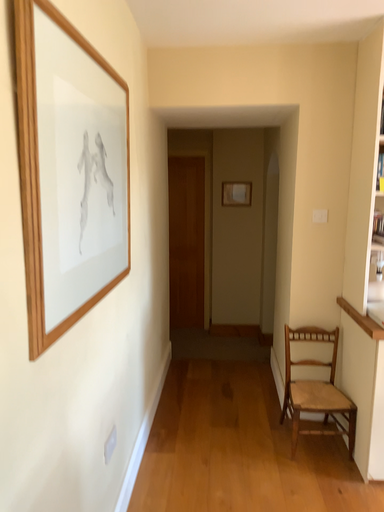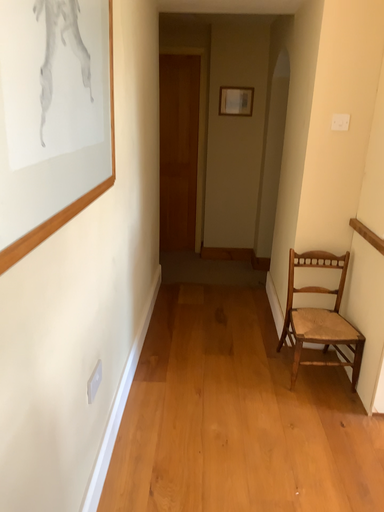
Question: How did the camera likely rotate when shooting the video?

Choices:
 (A) rotated downward
 (B) rotated upward

Answer: (A)